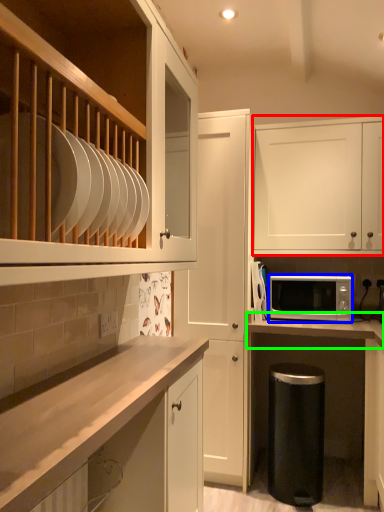
Question: Which object is the farthest from cabinetry (highlighted by a red box)? Choose among these: microwave oven (highlighted by a blue box) or countertop (highlighted by a green box).

Choices:
 (A) microwave oven
 (B) countertop

Answer: (B)